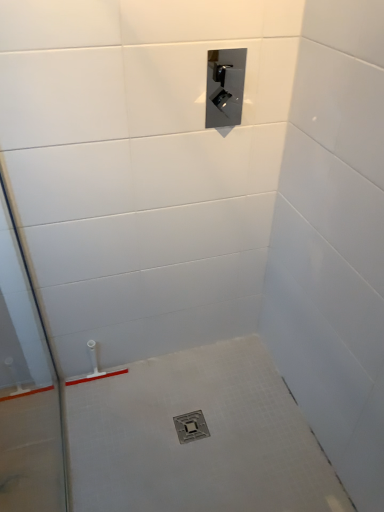
Question: Considering the relative sizes of transparent glass door at left and metallic silver drain at center in the image provided, is transparent glass door at left smaller than metallic silver drain at center?

Choices:
 (A) yes
 (B) no

Answer: (B)

Question: Is transparent glass door at left facing away from metallic silver drain at center?

Choices:
 (A) yes
 (B) no

Answer: (A)

Question: Is transparent glass door at left to the left of metallic silver drain at center from the viewer's perspective?

Choices:
 (A) no
 (B) yes

Answer: (B)

Question: From the image's perspective, is transparent glass door at left on top of metallic silver drain at center?

Choices:
 (A) no
 (B) yes

Answer: (B)

Question: Can you see transparent glass door at left touching metallic silver drain at center?

Choices:
 (A) no
 (B) yes

Answer: (A)

Question: From a real-world perspective, is transparent glass door at left positioned under metallic silver drain at center based on gravity?

Choices:
 (A) no
 (B) yes

Answer: (A)

Question: Considering the relative sizes of metallic silver drain at center and transparent glass door at left in the image provided, is metallic silver drain at center bigger than transparent glass door at left?

Choices:
 (A) yes
 (B) no

Answer: (B)

Question: Is transparent glass door at left at the back of metallic silver drain at center?

Choices:
 (A) yes
 (B) no

Answer: (B)

Question: Can you confirm if metallic silver drain at center is positioned to the left of transparent glass door at left?

Choices:
 (A) yes
 (B) no

Answer: (B)

Question: Is metallic silver drain at center at the right side of transparent glass door at left?

Choices:
 (A) yes
 (B) no

Answer: (A)

Question: Is metallic silver drain at center not inside transparent glass door at left?

Choices:
 (A) no
 (B) yes

Answer: (B)

Question: Is transparent glass door at left completely or partially inside metallic silver drain at center?

Choices:
 (A) yes
 (B) no

Answer: (B)

Question: Can you confirm if transparent glass door at left is shorter than satin nickel control panel at upper center?

Choices:
 (A) yes
 (B) no

Answer: (B)